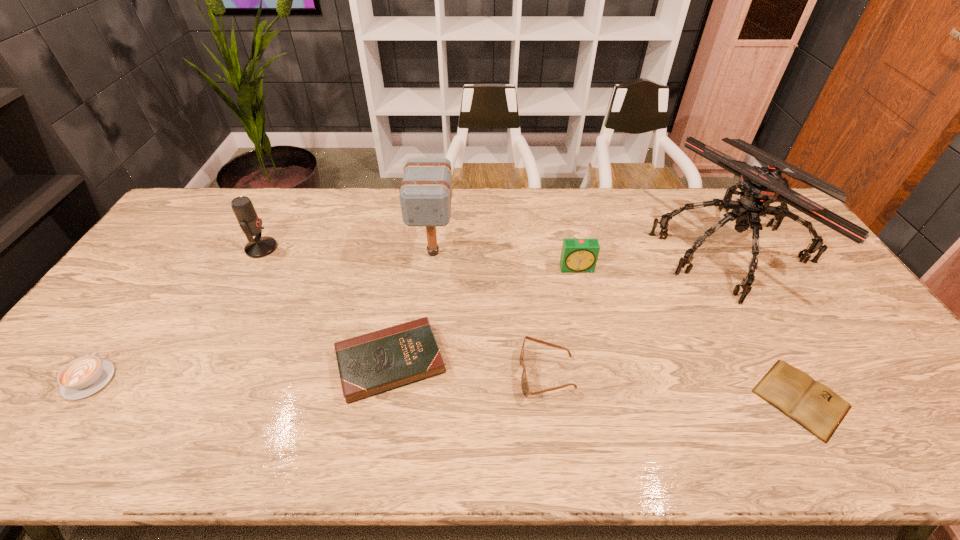
Identify the location of the shortest object. (813, 405).

Identify the location of free spot located 0.290m on the front of the drone. (821, 397).

Find the location of a particular element. Image resolution: width=960 pixels, height=540 pixels. free location located 0.350m on the striking surface of the mallet is located at coordinates (420, 371).

Where is `free space located 0.350m on the side of the sixth shortest object with the red ring`? Image resolution: width=960 pixels, height=540 pixels. free space located 0.350m on the side of the sixth shortest object with the red ring is located at coordinates (384, 248).

Locate an element on the screen. The height and width of the screenshot is (540, 960). vacant space located 0.230m on the front-facing side of the fifth shortest object is located at coordinates (592, 333).

This screenshot has width=960, height=540. Find the location of `vacant area located on the frames of the fourth object from right to left`. vacant area located on the frames of the fourth object from right to left is located at coordinates point(428,374).

Locate an element on the screen. Image resolution: width=960 pixels, height=540 pixels. vacant space located 0.190m on the frames of the fourth object from right to left is located at coordinates (444, 374).

You are a GUI agent. You are given a task and a screenshot of the screen. Output one action in this format:
    pyautogui.click(x=<x>, y=<y>)
    Task: Click on the vacant space positioned 0.340m on the frames of the fourth object from right to left
    
    Given the screenshot: What is the action you would take?
    pyautogui.click(x=384, y=374)

The width and height of the screenshot is (960, 540). In order to click on vacant space located 0.060m on the side of the leftmost object with the handle in this screenshot , I will do `click(118, 340)`.

Find the location of a particular element. vacant position located on the side of the leftmost object with the handle is located at coordinates (172, 265).